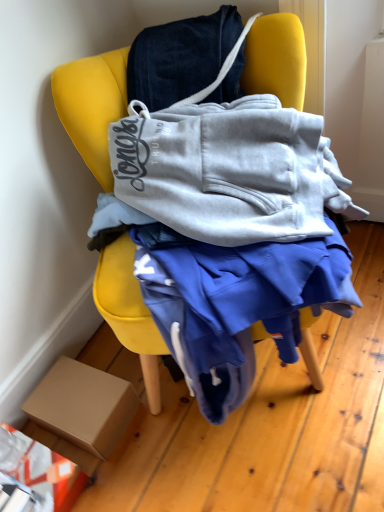
Image resolution: width=384 pixels, height=512 pixels. What are the coordinates of `yellow fabric chair at center` in the screenshot? It's located at (92, 106).

What do you see at coordinates (92, 106) in the screenshot?
I see `yellow fabric chair at center` at bounding box center [92, 106].

Measure the distance between point (136, 402) and camera.

The distance of point (136, 402) from camera is 3.69 feet.

Image resolution: width=384 pixels, height=512 pixels. In order to click on brown cardboard box at lower left in this screenshot , I will do `click(83, 405)`.

This screenshot has height=512, width=384. What do you see at coordinates (83, 405) in the screenshot?
I see `brown cardboard box at lower left` at bounding box center [83, 405].

What are the coordinates of `yellow fabric chair at center` in the screenshot? It's located at (92, 106).

Visually, is yellow fabric chair at center positioned to the left or to the right of brown cardboard box at lower left?

Based on their positions, yellow fabric chair at center is located to the right of brown cardboard box at lower left.

Considering their positions, is yellow fabric chair at center located in front of or behind brown cardboard box at lower left?

Clearly, yellow fabric chair at center is in front of brown cardboard box at lower left.

Which is farther from the camera, (248, 47) or (57, 403)?

The point (57, 403) is farther from the camera.

From the image's perspective, who appears lower, yellow fabric chair at center or brown cardboard box at lower left?

brown cardboard box at lower left appears lower in the image.

In the scene shown: From a real-world perspective, is yellow fabric chair at center under brown cardboard box at lower left?

Incorrect, from a real-world perspective, yellow fabric chair at center is higher than brown cardboard box at lower left.

Considering the sizes of objects yellow fabric chair at center and brown cardboard box at lower left in the image provided, who is wider, yellow fabric chair at center or brown cardboard box at lower left?

yellow fabric chair at center.

Who is shorter, yellow fabric chair at center or brown cardboard box at lower left?

With less height is brown cardboard box at lower left.

Does yellow fabric chair at center have a larger size compared to brown cardboard box at lower left?

Indeed, yellow fabric chair at center has a larger size compared to brown cardboard box at lower left.

Would you say yellow fabric chair at center is outside brown cardboard box at lower left?

Indeed, yellow fabric chair at center is completely outside brown cardboard box at lower left.

Is yellow fabric chair at center positioned far away from brown cardboard box at lower left?

No, yellow fabric chair at center is not far from brown cardboard box at lower left.

Is yellow fabric chair at center facing towards brown cardboard box at lower left?

No, yellow fabric chair at center is not facing towards brown cardboard box at lower left.

Find the location of a particular element. box below the yellow fabric chair at center (from the image's perspective) is located at coordinates (83, 405).

Between brown cardboard box at lower left and yellow fabric chair at center, which one appears on the right side from the viewer's perspective?

yellow fabric chair at center.

From the picture: Considering their positions, is brown cardboard box at lower left located in front of or behind yellow fabric chair at center?

In the image, brown cardboard box at lower left appears behind yellow fabric chair at center.

Is point (121, 398) in front of point (113, 106)?

No, (121, 398) is further to viewer.

From the image's perspective, which object appears higher, brown cardboard box at lower left or yellow fabric chair at center?

yellow fabric chair at center is shown above in the image.

From a real-world perspective, is brown cardboard box at lower left positioned over yellow fabric chair at center based on gravity?

Actually, brown cardboard box at lower left is physically below yellow fabric chair at center in the real world.

Can you confirm if brown cardboard box at lower left is thinner than yellow fabric chair at center?

Yes.

Does brown cardboard box at lower left have a greater height compared to yellow fabric chair at center?

No.

From the picture: Is brown cardboard box at lower left bigger than yellow fabric chair at center?

Incorrect, brown cardboard box at lower left is not larger than yellow fabric chair at center.

Is brown cardboard box at lower left spatially inside yellow fabric chair at center, or outside of it?

brown cardboard box at lower left is not inside yellow fabric chair at center, it's outside.

Would you consider brown cardboard box at lower left to be distant from yellow fabric chair at center?

brown cardboard box at lower left is near yellow fabric chair at center, not far away.

Is brown cardboard box at lower left turned away from yellow fabric chair at center?

brown cardboard box at lower left is not turned away from yellow fabric chair at center.

What's the angular difference between brown cardboard box at lower left and yellow fabric chair at center's facing directions?

They differ by 54.9 degrees in their facing directions.

How far apart are brown cardboard box at lower left and yellow fabric chair at center?

brown cardboard box at lower left is 10.19 inches from yellow fabric chair at center.

The height and width of the screenshot is (512, 384). In the image, there is a brown cardboard box at lower left. Identify the location of chair above it (from the image's perspective). (92, 106).

You are a GUI agent. You are given a task and a screenshot of the screen. Output one action in this format:
    pyautogui.click(x=<x>, y=<y>)
    Task: Click on the chair located on the right of brown cardboard box at lower left
    The width and height of the screenshot is (384, 512).
    Given the screenshot: What is the action you would take?
    pyautogui.click(x=92, y=106)

Where is `box that is behind the yellow fabric chair at center`? The height and width of the screenshot is (512, 384). box that is behind the yellow fabric chair at center is located at coordinates (83, 405).